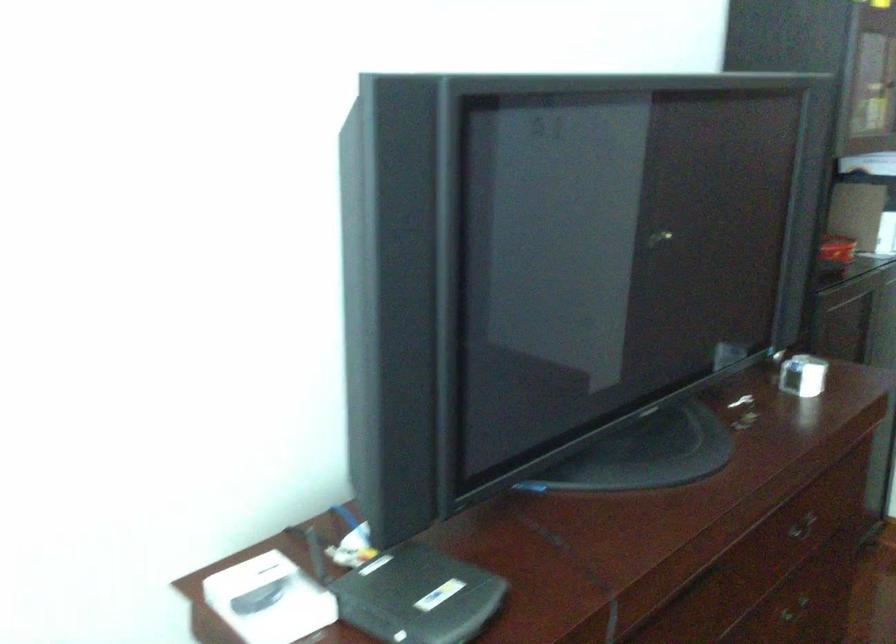
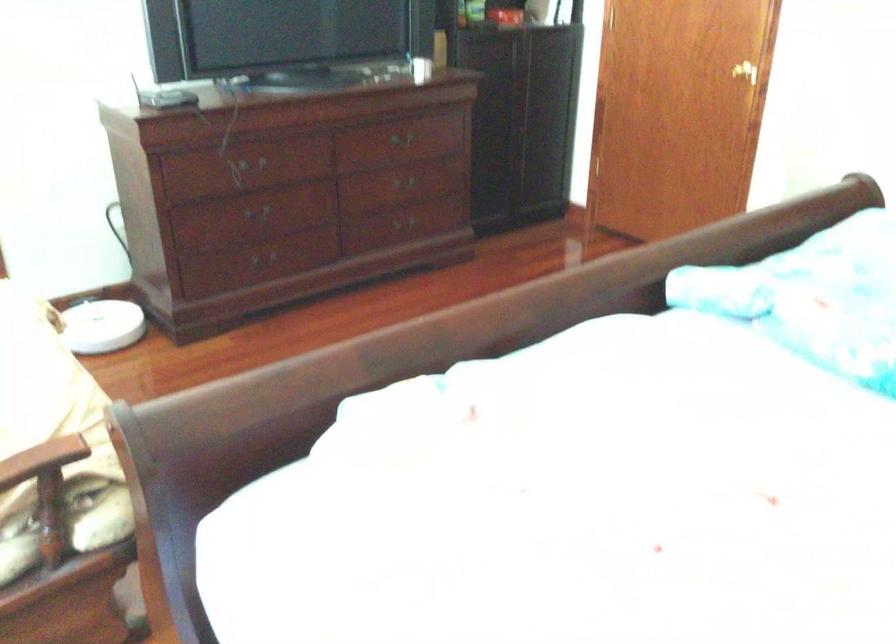
From the picture: Which direction would the cameraman need to move to produce the second image?

The cameraman walked toward right, backward.